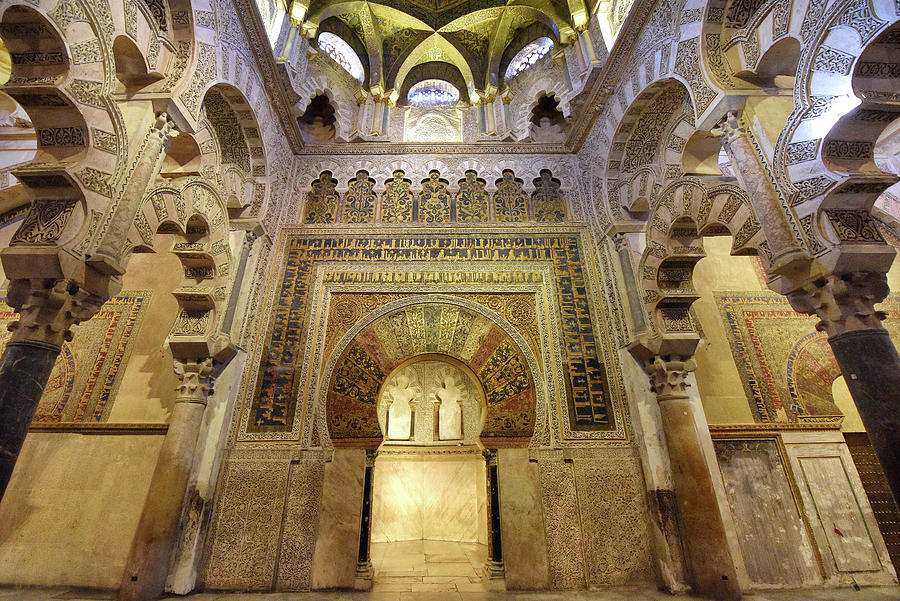
Where is `unadorned stone wall`? The width and height of the screenshot is (900, 601). unadorned stone wall is located at coordinates click(88, 468), click(156, 306), click(716, 267), click(711, 377), click(518, 496), click(340, 513).